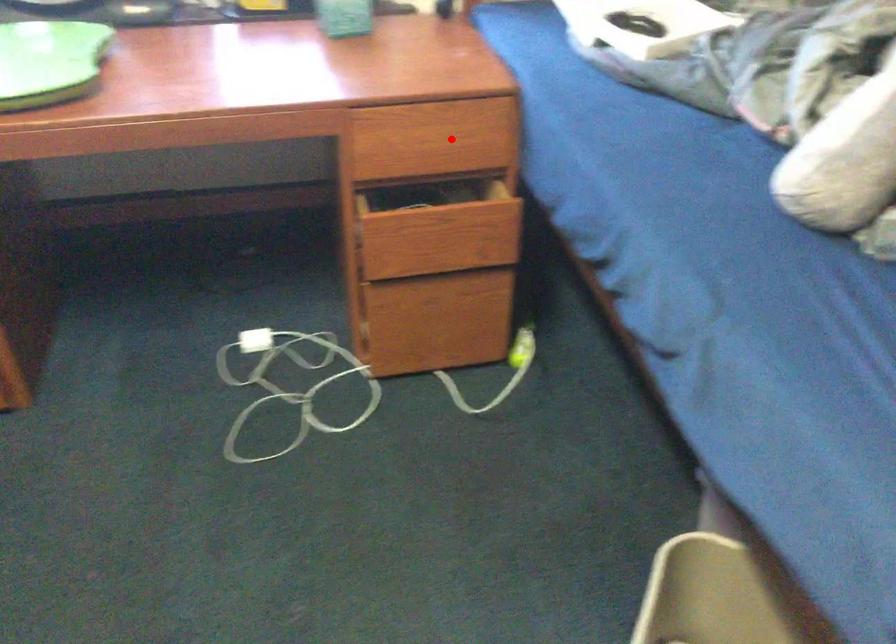
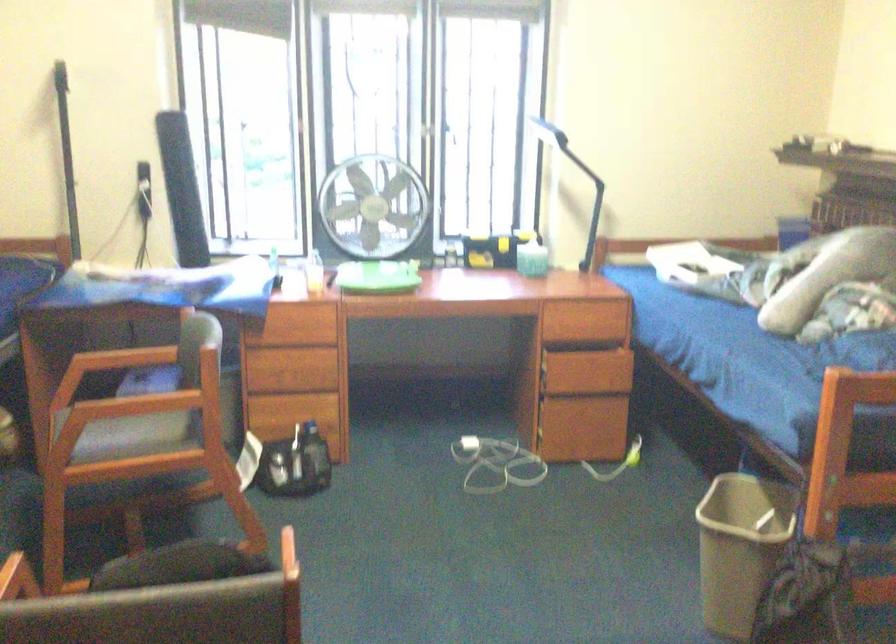
Question: I am providing you with two images of the same scene from different viewpoints. A red point is shown in image1. For the corresponding object point in image2, is it positioned nearer or farther from the camera?

Choices:
 (A) Nearer
 (B) Farther

Answer: (B)